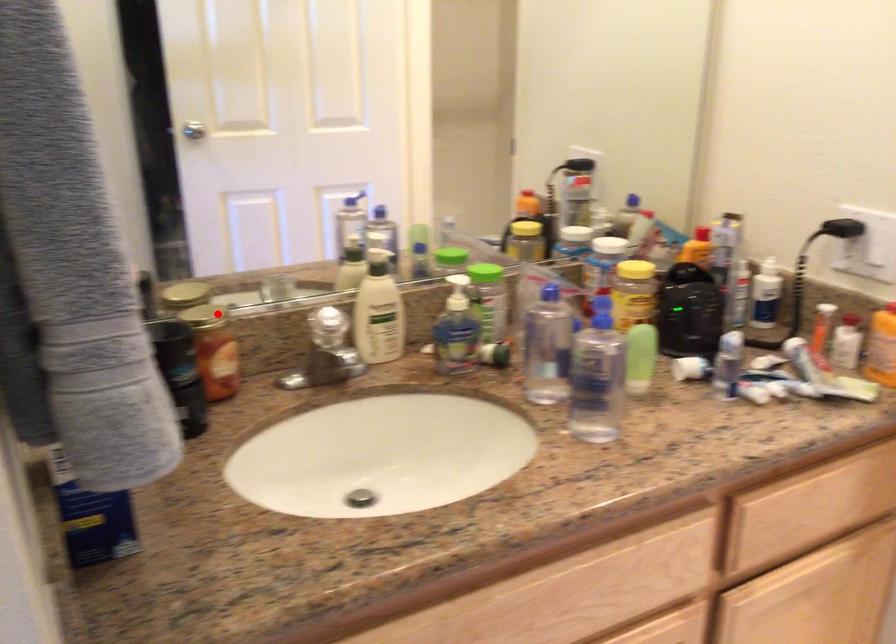
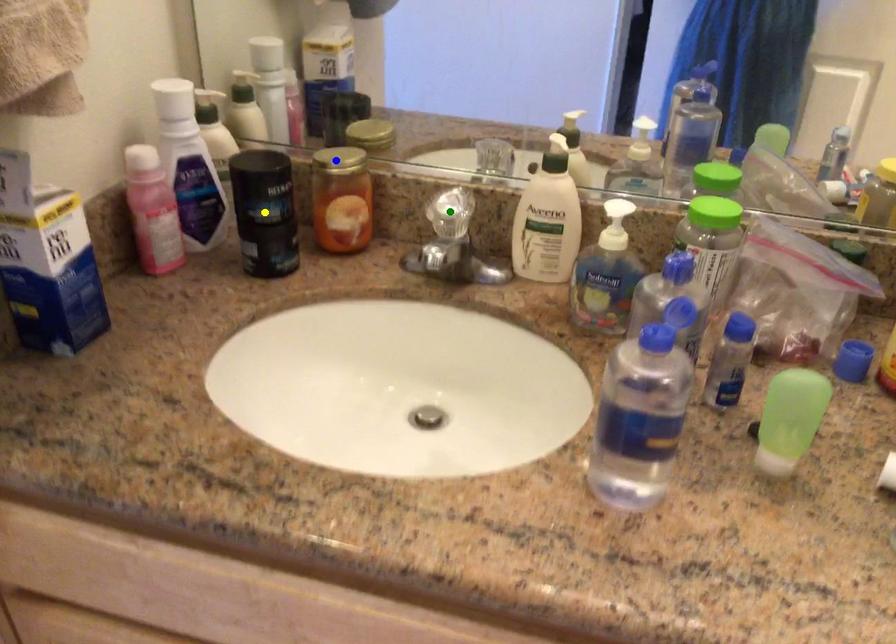
Question: I am providing you with two images of the same scene from different viewpoints. A red point is marked on the first image. You are given multiple points on the second image. In image 2, which mark is for the same physical point as the one in image 1?

Choices:
 (A) yellow point
 (B) blue point
 (C) green point

Answer: (B)